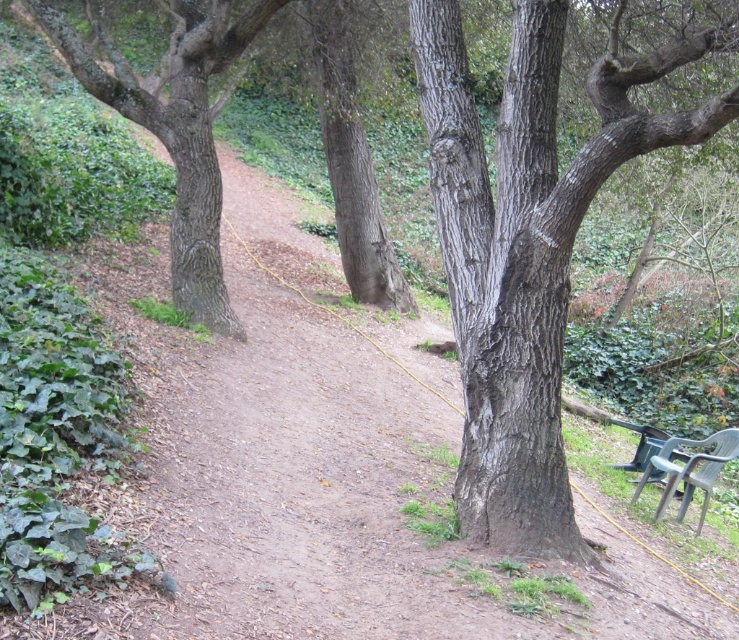
Who is taller, smooth gray bark tree at center or green plastic chair at lower right?

Standing taller between the two is smooth gray bark tree at center.

Is smooth gray bark tree at center thinner than green plastic chair at lower right?

No, smooth gray bark tree at center is not thinner than green plastic chair at lower right.

Who is more distant from viewer, (650, 116) or (678, 472)?

Point (678, 472)

In order to click on smooth gray bark tree at center in this screenshot , I will do 527,246.

Which is in front, point (217, 225) or point (718, 436)?

Point (718, 436)

Does smooth bark tree at center lie in front of green plastic chair at lower right?

No.

Between point (194, 179) and point (653, 458), which one is positioned in front?

Point (653, 458)

The height and width of the screenshot is (640, 739). Identify the location of smooth bark tree at center. (177, 132).

Who is more forward, (522,6) or (265,20)?

Point (522,6) is in front.

Can you confirm if smooth gray bark tree at center is bigger than smooth bark tree at center?

Actually, smooth gray bark tree at center might be smaller than smooth bark tree at center.

Who is more distant from viewer, (520, 108) or (265, 0)?

Point (265, 0)

Where is `smooth gray bark tree at center`? Image resolution: width=739 pixels, height=640 pixels. smooth gray bark tree at center is located at coordinates (527, 246).